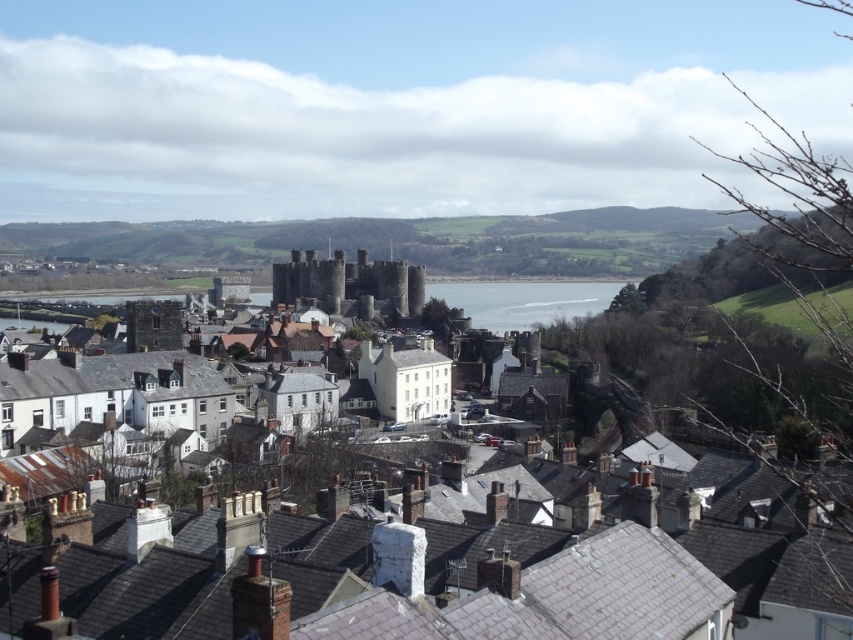
Question: Does stone castle at center appear over dark gray stone castle at center?

Choices:
 (A) no
 (B) yes

Answer: (A)

Question: Estimate the real-world distances between objects in this image. Which object is farther from the clear blue water at center?

Choices:
 (A) dark gray stone castle at center
 (B) stone castle at center

Answer: (B)

Question: Considering the relative positions of dark gray stone castle at center and clear blue water at center in the image provided, where is dark gray stone castle at center located with respect to clear blue water at center?

Choices:
 (A) above
 (B) below

Answer: (A)

Question: Which is nearer to the clear blue water at center?

Choices:
 (A) dark gray stone castle at center
 (B) stone castle at center

Answer: (A)

Question: Which of the following is the closest to the observer?

Choices:
 (A) (424, 284)
 (B) (587, 616)

Answer: (B)

Question: Does stone castle at center have a larger size compared to dark gray stone castle at center?

Choices:
 (A) no
 (B) yes

Answer: (A)